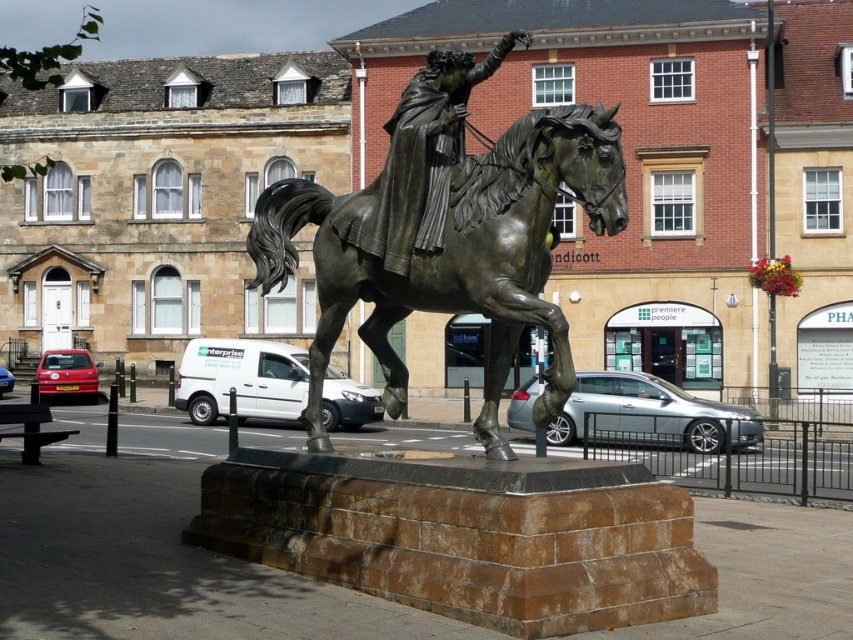
Question: Which object appears farthest from the camera in this image?

Choices:
 (A) bronze/statue at center
 (B) bronze statue at center

Answer: (B)

Question: Which object is farther from the camera taking this photo?

Choices:
 (A) bronze statue at center
 (B) bronze/statue at center

Answer: (A)

Question: Does bronze/statue at center appear under bronze statue at center?

Choices:
 (A) yes
 (B) no

Answer: (A)

Question: Does bronze/statue at center lie behind bronze statue at center?

Choices:
 (A) yes
 (B) no

Answer: (B)

Question: Which point is closer to the camera?

Choices:
 (A) bronze/statue at center
 (B) bronze statue at center

Answer: (A)

Question: Observing the image, what is the correct spatial positioning of bronze/statue at center in reference to bronze statue at center?

Choices:
 (A) right
 (B) left

Answer: (B)